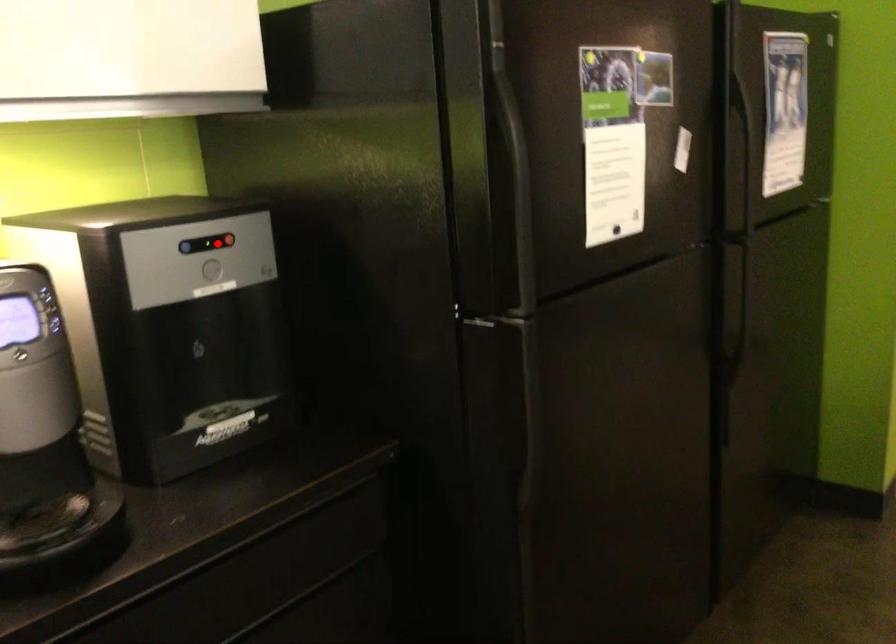
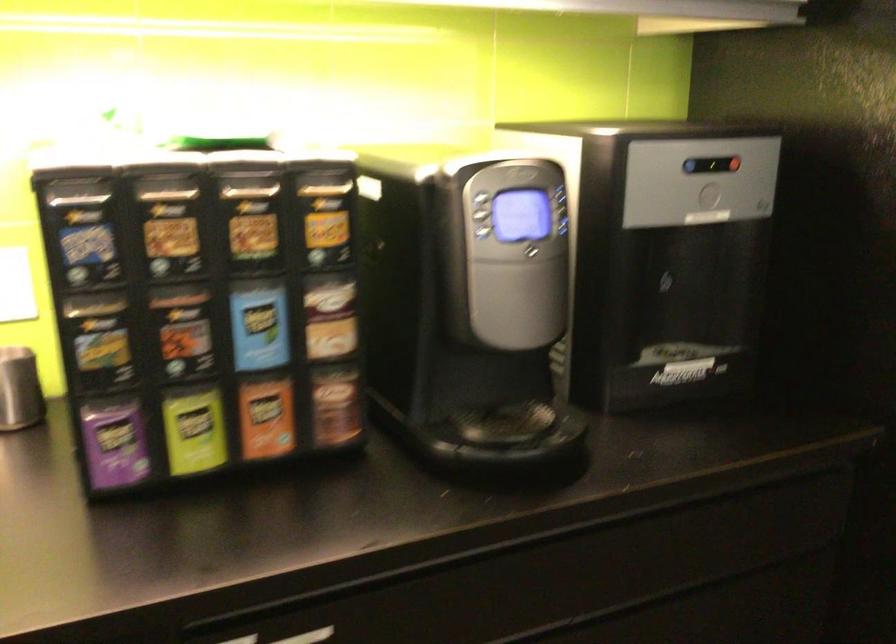
Locate, in the second image, the point that corresponds to the highlighted location in the first image.

(724, 163)